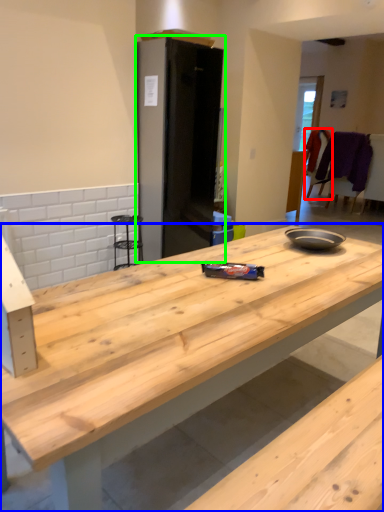
Question: Which object is positioned farthest from chair (highlighted by a red box)? Select from countertop (highlighted by a blue box) and appliance (highlighted by a green box).

Choices:
 (A) countertop
 (B) appliance

Answer: (A)